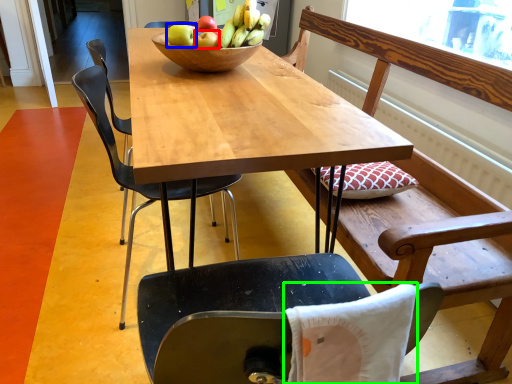
Question: Based on their relative distances, which object is nearer to apple (highlighted by a red box)? Choose from apple (highlighted by a blue box) and pillow (highlighted by a green box).

Choices:
 (A) apple
 (B) pillow

Answer: (A)